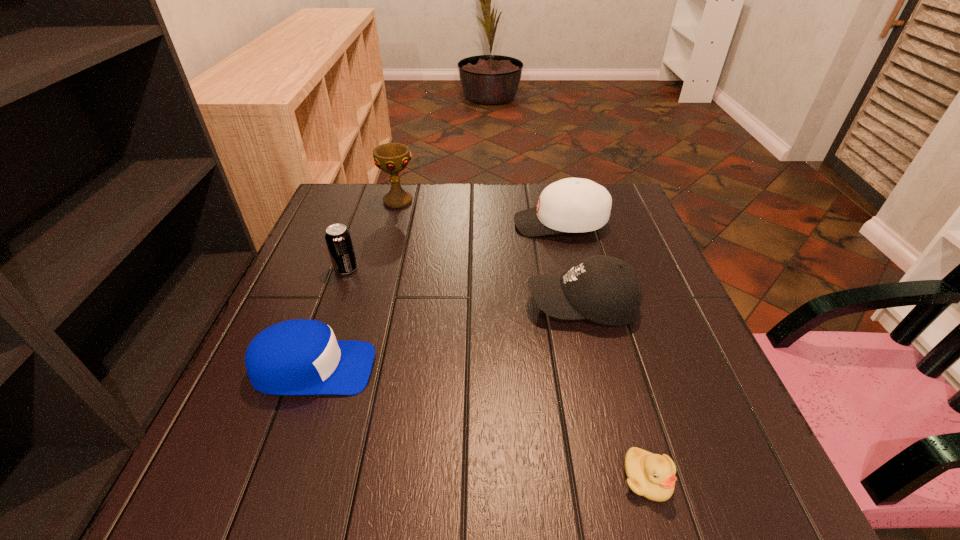
At what (x,y) coordinates should I click in order to perform the action: click on blank area located on the front-facing side of the farthest baseball cap. Please return your answer as a coordinate pair (x, y). Looking at the image, I should click on (404, 224).

At what (x,y) coordinates should I click in order to perform the action: click on free spot located on the front-facing side of the farthest baseball cap. Please return your answer as a coordinate pair (x, y). Image resolution: width=960 pixels, height=540 pixels. Looking at the image, I should click on (455, 224).

At what (x,y) coordinates should I click in order to perform the action: click on free space located 0.130m on the front-facing side of the second farthest baseball cap. Please return your answer as a coordinate pair (x, y). Looking at the image, I should click on (468, 305).

You are a GUI agent. You are given a task and a screenshot of the screen. Output one action in this format:
    pyautogui.click(x=<x>, y=<y>)
    Task: Click on the vacant region located on the front-facing side of the second farthest baseball cap
    The image size is (960, 540).
    Given the screenshot: What is the action you would take?
    pyautogui.click(x=358, y=305)

This screenshot has width=960, height=540. I want to click on vacant space situated 0.270m on the front-facing side of the second farthest baseball cap, so coord(403,305).

The width and height of the screenshot is (960, 540). Find the location of `vacant space located 0.150m on the front of the soda can`. vacant space located 0.150m on the front of the soda can is located at coordinates (326, 323).

Where is `free space located on the front-facing side of the shortest baseball cap`? Image resolution: width=960 pixels, height=540 pixels. free space located on the front-facing side of the shortest baseball cap is located at coordinates (478, 368).

What are the coordinates of `chalice at the far edge` in the screenshot? It's located at (392, 158).

At what (x,y) coordinates should I click in order to perform the action: click on baseball cap present at the far edge. Please return your answer as a coordinate pair (x, y). Looking at the image, I should click on (574, 205).

Find the location of a particular element. object that is at the near edge is located at coordinates (650, 475).